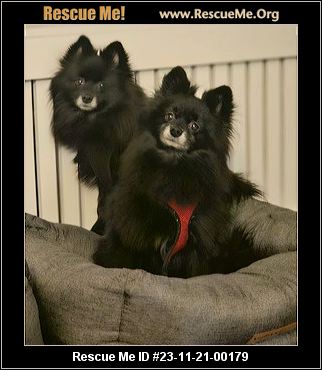
You are a GUI agent. You are given a task and a screenshot of the screen. Output one action in this format:
    pyautogui.click(x=<x>, y=<y>)
    Task: Click on the wall
    
    Given the screenshot: What is the action you would take?
    [242, 42]